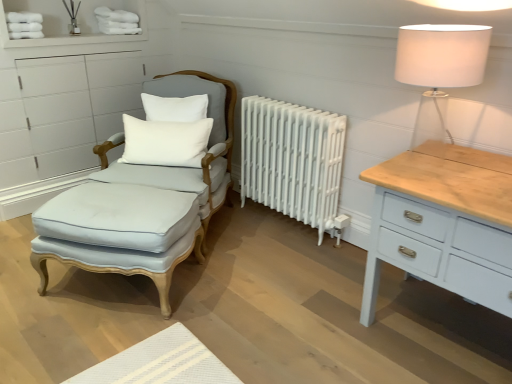
Question: Should I look upward or downward to see light blue fabric footrest at left?

Choices:
 (A) up
 (B) down

Answer: (B)

Question: From a real-world perspective, is white fabric lampshade at upper right under white painted metal radiator at center?

Choices:
 (A) yes
 (B) no

Answer: (B)

Question: Are white fabric lampshade at upper right and white painted metal radiator at center making contact?

Choices:
 (A) no
 (B) yes

Answer: (A)

Question: Is the depth of white fabric lampshade at upper right greater than that of white painted metal radiator at center?

Choices:
 (A) no
 (B) yes

Answer: (A)

Question: Would you say white fabric lampshade at upper right is outside white painted metal radiator at center?

Choices:
 (A) yes
 (B) no

Answer: (A)

Question: Can you confirm if white fabric lampshade at upper right is shorter than white painted metal radiator at center?

Choices:
 (A) yes
 (B) no

Answer: (A)

Question: Is white painted metal radiator at center inside white fabric lampshade at upper right?

Choices:
 (A) yes
 (B) no

Answer: (B)

Question: Does light blue fabric footrest at left have a greater width compared to white fabric lampshade at upper right?

Choices:
 (A) yes
 (B) no

Answer: (A)

Question: Is light blue fabric footrest at left to the left of white fabric lampshade at upper right from the viewer's perspective?

Choices:
 (A) yes
 (B) no

Answer: (A)

Question: From a real-world perspective, is light blue fabric footrest at left over white fabric lampshade at upper right?

Choices:
 (A) no
 (B) yes

Answer: (A)

Question: From the image's perspective, does light blue fabric footrest at left appear higher than white fabric lampshade at upper right?

Choices:
 (A) no
 (B) yes

Answer: (A)

Question: From the image's perspective, is light blue fabric footrest at left under white fabric lampshade at upper right?

Choices:
 (A) yes
 (B) no

Answer: (A)

Question: Is light blue fabric footrest at left at the right side of white fabric lampshade at upper right?

Choices:
 (A) no
 (B) yes

Answer: (A)

Question: From the image's perspective, is light blue fabric footrest at left located beneath light blue fabric swivel chair at left?

Choices:
 (A) yes
 (B) no

Answer: (A)